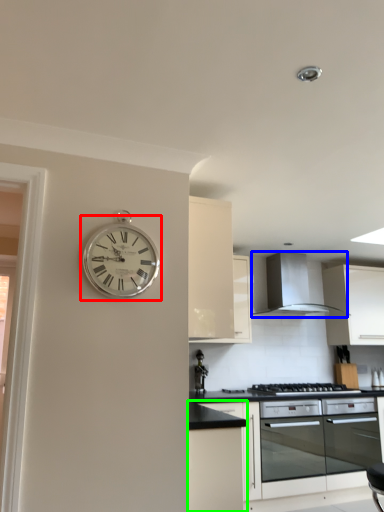
Question: Which is farther away from wall clock (highlighted by a red box)? exhaust hood (highlighted by a blue box) or cabinetry (highlighted by a green box)?

Choices:
 (A) exhaust hood
 (B) cabinetry

Answer: (A)